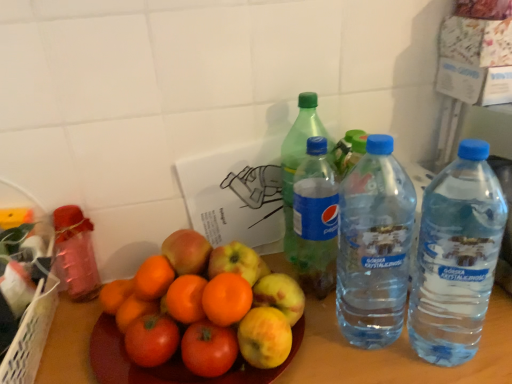
Question: Is metallic pink bottle at left, which appears as the fifth bottle when viewed from the right, bigger or smaller than orange matte at center?

Choices:
 (A) small
 (B) big

Answer: (A)

Question: Visually, is metallic pink bottle at left, which appears as the fifth bottle when viewed from the right, positioned to the left or to the right of orange matte at center?

Choices:
 (A) left
 (B) right

Answer: (A)

Question: Estimate the real-world distances between objects in this image. Which object is farther from the green plastic bottle at center, arranged as the third bottle when viewed from the right?

Choices:
 (A) orange matte at center
 (B) clear plastic water bottle at right, arranged as the 4th bottle when viewed from the left
 (C) transparent plastic bottle at right, which ranks as the first bottle in right-to-left order
 (D) green plastic bottle at center, which ranks as the 2th bottle in left-to-right order
 (E) metallic pink bottle at left, which appears as the fifth bottle when viewed from the right

Answer: (E)

Question: Considering the real-world distances, which object is closest to the clear plastic water bottle at right, placed as the 2th bottle when sorted from right to left?

Choices:
 (A) green plastic bottle at center, arranged as the third bottle when viewed from the right
 (B) transparent plastic bottle at right, which ranks as the first bottle in right-to-left order
 (C) orange matte at center
 (D) metallic pink bottle at left, which appears as the fifth bottle when viewed from the right
 (E) green plastic bottle at center, which is the fourth bottle in right-to-left order

Answer: (A)